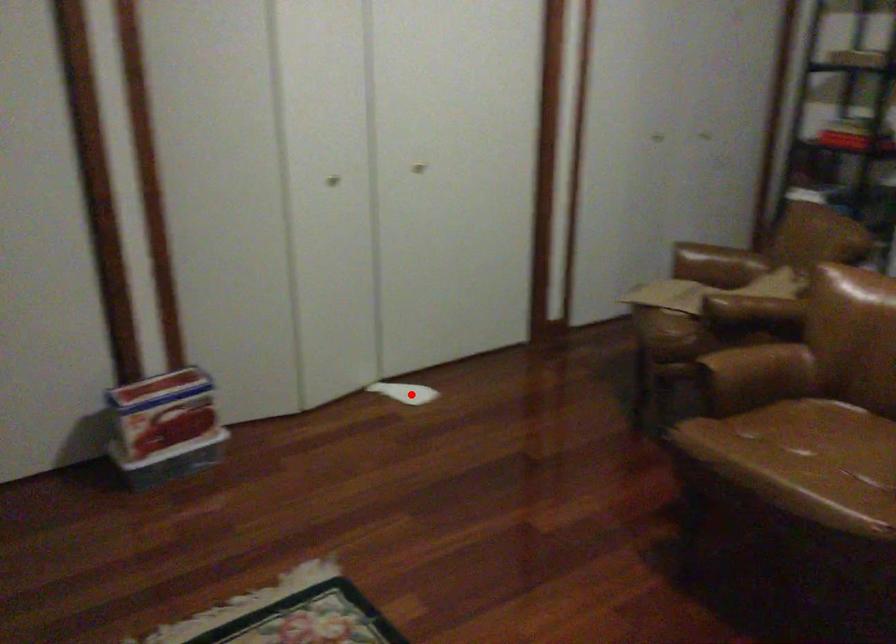
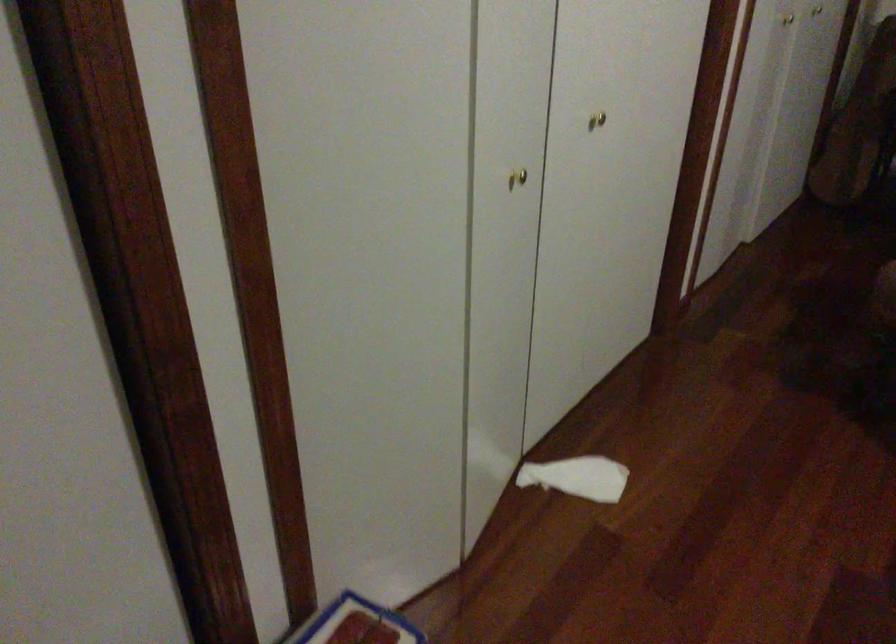
Where in the second image is the point corresponding to the highlighted location from the first image?

(578, 477)